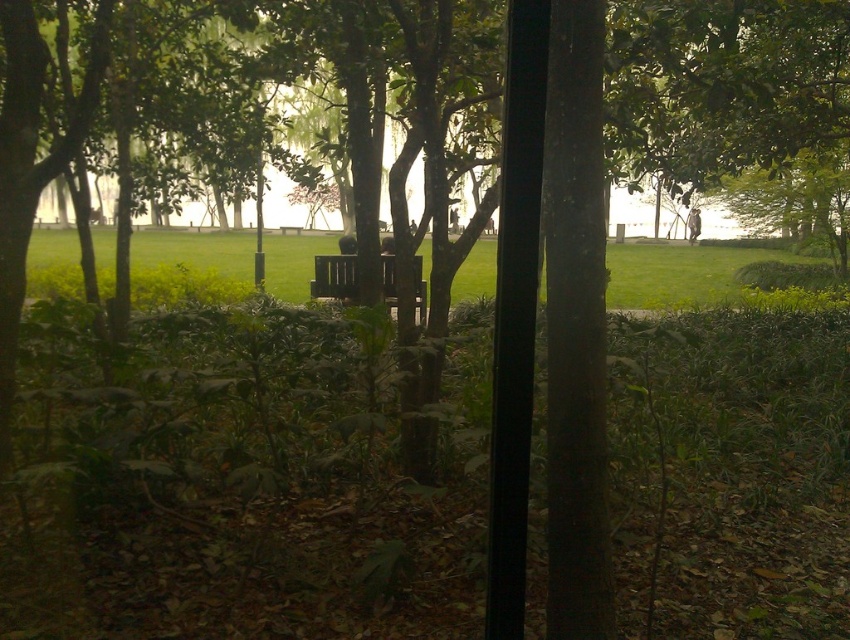
Consider the image. You are planning to set up a picnic in the park and have a large blanket that covers the entire green grassy at center. Will there be enough space left for the wooden bench at center to be visible after placing the blanket?

The green grassy at center is bigger than the wooden bench at center. Since the blanket covers the entire green grassy area, the wooden bench at center will still be visible as it is smaller in size and possibly positioned within or adjacent to the grassy area.